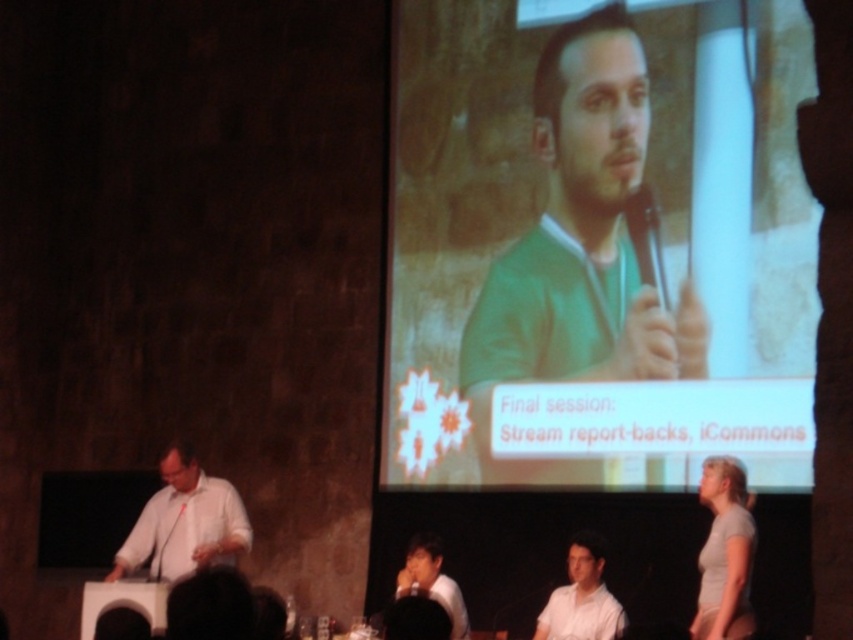
You are a photographer trying to capture a clear image of the speaker wearing the white matte shirt at left during a video conference. The camera you are using has a maximum focus range of 25 meters. Can you successfully take the photo without moving closer?

The white matte shirt at left and camera are 27.89 meters apart from each other. Since the camera can only focus up to 25 meters, you cannot take a clear photo without moving closer.